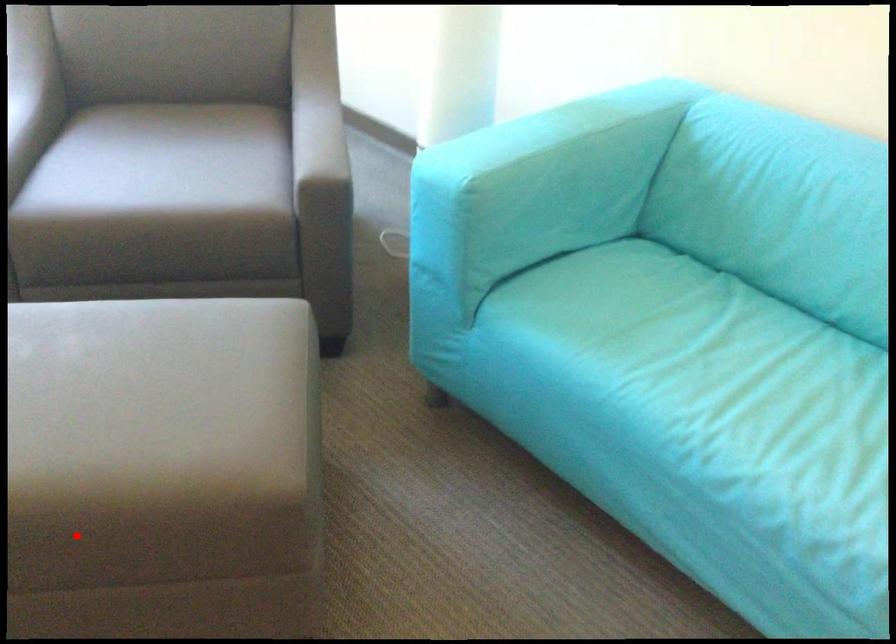
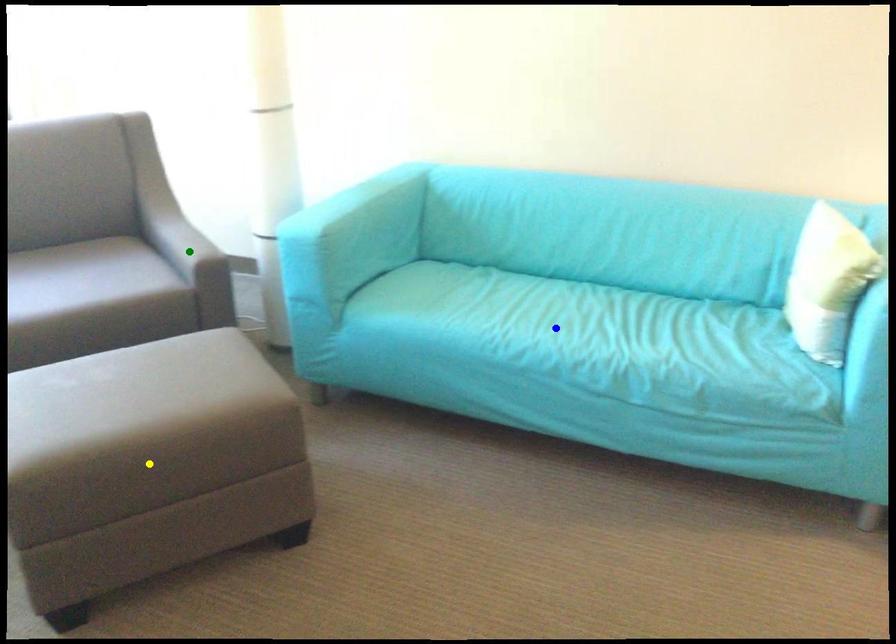
Question: I am providing you with two images of the same scene from different viewpoints. A red point is marked on the first image. You are given multiple points on the second image. Which spot in image 2 lines up with the point in image 1?

Choices:
 (A) green point
 (B) blue point
 (C) yellow point

Answer: (C)